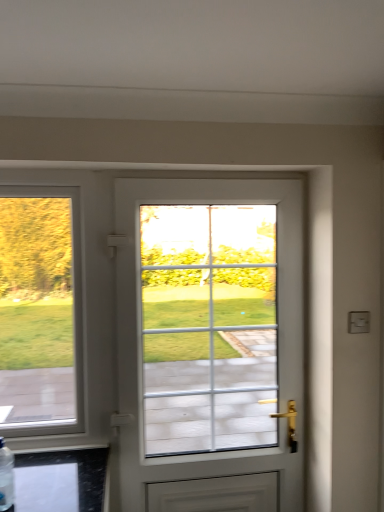
Question: Does white glossy door at center have a greater height compared to clear plastic bottle at lower left?

Choices:
 (A) no
 (B) yes

Answer: (B)

Question: Could you tell me if white glossy door at center is turned towards clear plastic bottle at lower left?

Choices:
 (A) no
 (B) yes

Answer: (A)

Question: Considering the relative sizes of white glossy door at center and clear plastic bottle at lower left in the image provided, is white glossy door at center bigger than clear plastic bottle at lower left?

Choices:
 (A) yes
 (B) no

Answer: (A)

Question: Is white glossy door at center shorter than clear plastic bottle at lower left?

Choices:
 (A) yes
 (B) no

Answer: (B)

Question: From a real-world perspective, is white glossy door at center under clear plastic bottle at lower left?

Choices:
 (A) yes
 (B) no

Answer: (B)

Question: Can you confirm if white glossy door at center is positioned to the left of clear plastic bottle at lower left?

Choices:
 (A) yes
 (B) no

Answer: (B)

Question: Is clear plastic bottle at lower left further to camera compared to white glossy door at center?

Choices:
 (A) yes
 (B) no

Answer: (B)

Question: Is clear plastic bottle at lower left beside white glossy door at center?

Choices:
 (A) yes
 (B) no

Answer: (B)

Question: From the image's perspective, is clear plastic bottle at lower left over white glossy door at center?

Choices:
 (A) yes
 (B) no

Answer: (B)

Question: Does clear plastic bottle at lower left appear on the right side of white glossy door at center?

Choices:
 (A) yes
 (B) no

Answer: (B)

Question: Does clear plastic bottle at lower left appear on the left side of white glossy door at center?

Choices:
 (A) no
 (B) yes

Answer: (B)

Question: Can you confirm if clear plastic bottle at lower left is wider than white glossy door at center?

Choices:
 (A) yes
 (B) no

Answer: (B)

Question: From the image's perspective, relative to clear plastic bottle at lower left, is white glossy door at center above or below?

Choices:
 (A) below
 (B) above

Answer: (B)